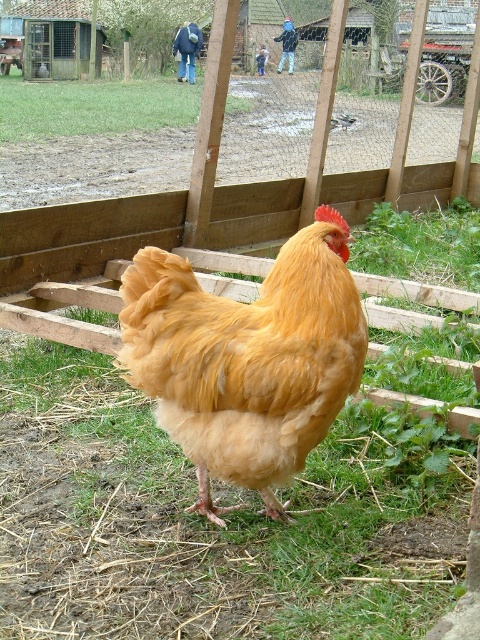
You are a farmer checking the enclosure. You need to know if the golden feathered rooster at center can fit through a gap in the fence that is the same width as the green grass at center. Can it?

The golden feathered rooster at center is narrower than the green grass at center, so it can fit through the gap in the fence.

You are a farmer checking the condition of your farm. You notice the golden feathered rooster at center and the green grass at center. Which object is nearer to you?

The golden feathered rooster at center is closer to the viewer than the green grass at center.

You are a farmer checking the field. You see the golden feathered rooster at center and the green grass at center. How far apart are these two objects?

The distance between the golden feathered rooster at center and the green grass at center is 12.16 meters.